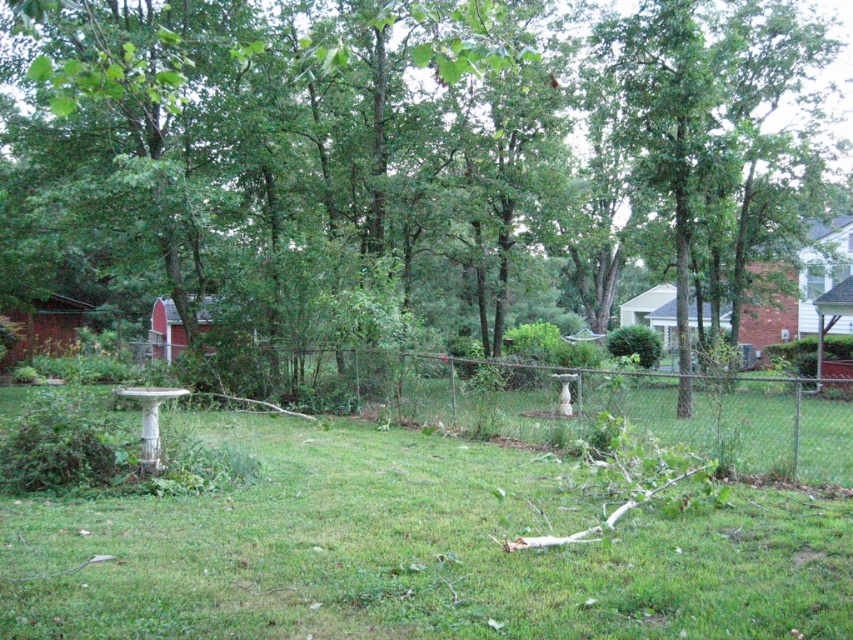
In the scene shown: You are standing in the backyard and want to take a photo of the point at coordinates (343,280). If your camera has a maximum focus range of 18 meters, will it be able to focus on the point?

The point at coordinates (343,280) is 18.47 meters away from the camera. Since the camera can only focus up to 18 meters, it will not be able to focus on the point.

You are trying to determine the spatial relationship between the green leafy tree at center and the green grassy at center in the backyard scene. Which object occupies a wider area in the image?

The green leafy tree at center has a larger width than the green grassy at center, so it occupies a wider area in the image.